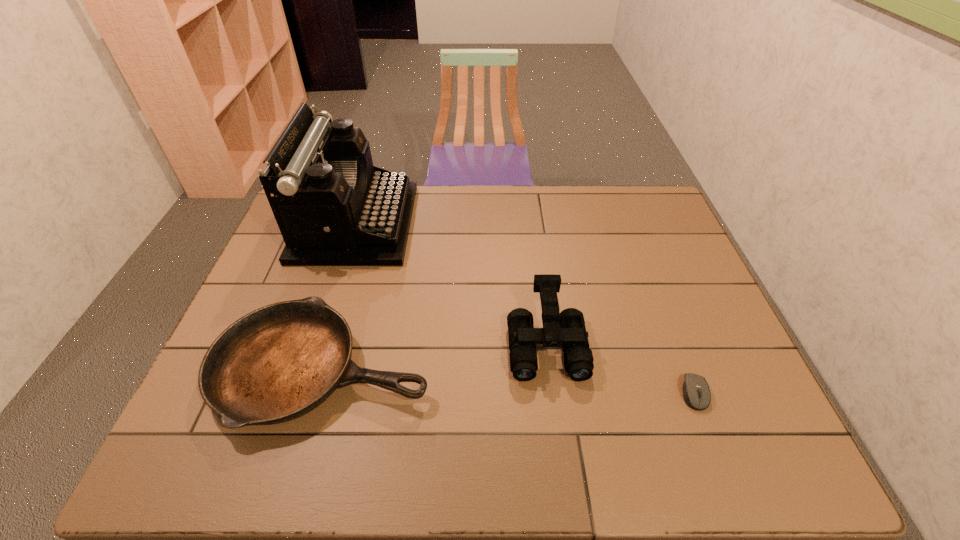
You are a GUI agent. You are given a task and a screenshot of the screen. Output one action in this format:
    pyautogui.click(x=<x>, y=<y>)
    Task: Click on the vacant point at the far right corner
    The width and height of the screenshot is (960, 540).
    Given the screenshot: What is the action you would take?
    pyautogui.click(x=635, y=191)

I want to click on free space between the shortest object and the tallest object, so click(x=525, y=308).

The image size is (960, 540). I want to click on unoccupied position between the farthest object and the second shortest object, so click(x=340, y=296).

Where is `vacant space that is in between the typewriter and the second tallest object`? The image size is (960, 540). vacant space that is in between the typewriter and the second tallest object is located at coordinates (451, 284).

The image size is (960, 540). In order to click on free space between the second shortest object and the tallest object in this screenshot , I will do pos(340,296).

Where is `free area in between the computer equipment and the typewriter`? free area in between the computer equipment and the typewriter is located at coordinates (525, 308).

Image resolution: width=960 pixels, height=540 pixels. I want to click on vacant area that lies between the frying pan and the binoculars, so click(x=435, y=357).

The width and height of the screenshot is (960, 540). In order to click on free space that is in between the typewriter and the computer equipment in this screenshot , I will do `click(525, 308)`.

The image size is (960, 540). I want to click on free spot between the second tallest object and the typewriter, so point(451,284).

You are a GUI agent. You are given a task and a screenshot of the screen. Output one action in this format:
    pyautogui.click(x=<x>, y=<y>)
    Task: Click on the vacant region between the computer equipment and the typewriter
    
    Given the screenshot: What is the action you would take?
    pyautogui.click(x=525, y=308)